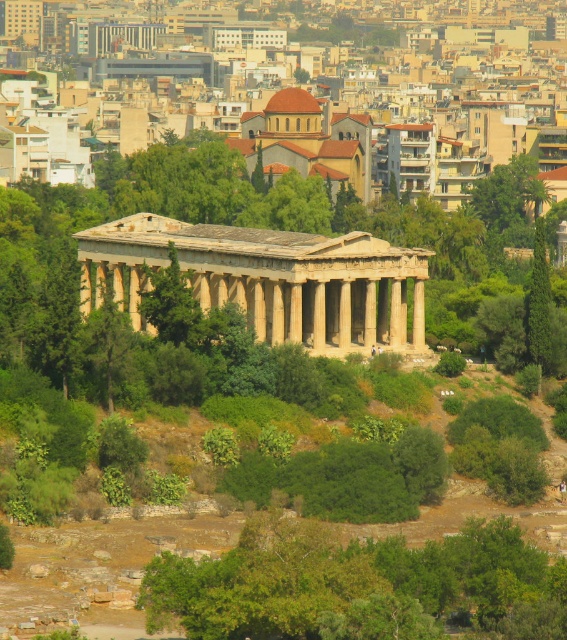
You are an urban planner analyzing the image. The beige stone temple at center and the green leafy tree at upper center are both key elements in the scene. Based on their sizes, which one would require more horizontal space for preservation efforts?

The beige stone temple at center requires more horizontal space for preservation efforts since its width is larger than the green leafy tree at upper center.

You are an architect assessing the visual impact of the ancient temple against the modern cityscape. Considering the beige stone temple at center and the green leafy tree at upper center, which object is taller?

The beige stone temple at center is taller than the green leafy tree at upper center according to the description provided.

Based on the photo, you are an urban planner assessing the balance between nature and urban development in the image. You notice two green leafy trees in the scene. Which tree, the green leafy tree at center or the green leafy tree at upper center, is smaller in size?

The green leafy tree at center is smaller in size compared to the green leafy tree at upper center.